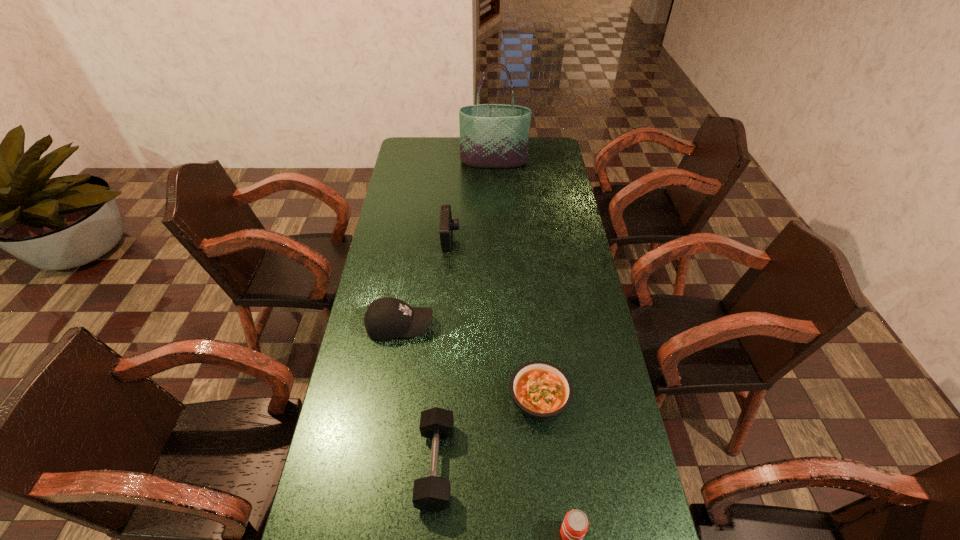
Locate an element on the screen. the farthest object is located at coordinates (491, 135).

Where is `tote bag`? The image size is (960, 540). tote bag is located at coordinates (491, 135).

Locate an element on the screen. The width and height of the screenshot is (960, 540). camera is located at coordinates (x=447, y=223).

The height and width of the screenshot is (540, 960). In order to click on baseball cap in this screenshot , I will do `click(387, 318)`.

Where is `dumbbell`? dumbbell is located at coordinates [x=432, y=493].

The image size is (960, 540). What are the coordinates of `stew` in the screenshot? It's located at (541, 390).

Find the location of a particular element. Image resolution: width=960 pixels, height=540 pixels. vacant position located 0.130m on the back of the tallest object is located at coordinates (493, 141).

Where is `vacant space located 0.360m on the front-facing side of the fifth nearest object`? vacant space located 0.360m on the front-facing side of the fifth nearest object is located at coordinates (549, 239).

The image size is (960, 540). I want to click on blank area located on the front-facing side of the fourth nearest object, so click(x=524, y=326).

Where is `free space located 0.110m on the right of the dumbbell`? This screenshot has width=960, height=540. free space located 0.110m on the right of the dumbbell is located at coordinates (494, 465).